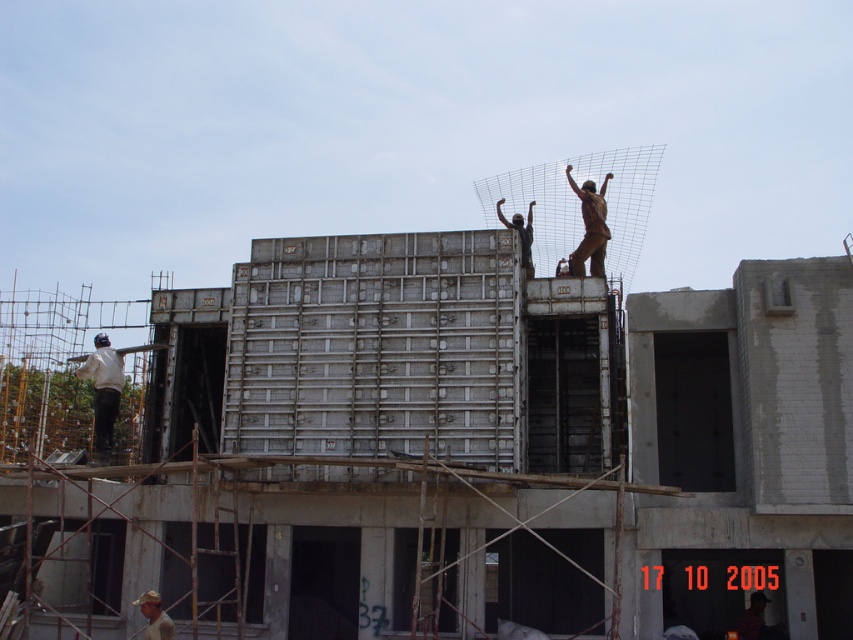
Question: Which point is farther from the camera taking this photo?

Choices:
 (A) (155, 605)
 (B) (531, 211)

Answer: (B)

Question: Does bronze statue at upper right appear on the left side of tan fabric cap at lower left?

Choices:
 (A) yes
 (B) no

Answer: (B)

Question: Is bronze statue at upper right smaller than matte black statue at upper center?

Choices:
 (A) yes
 (B) no

Answer: (B)

Question: Based on their relative distances, which object is farther from the tan fabric cap at lower left?

Choices:
 (A) bronze statue at upper right
 (B) matte black statue at upper center

Answer: (A)

Question: Is tan fabric cap at lower left positioned before matte black statue at upper center?

Choices:
 (A) no
 (B) yes

Answer: (B)

Question: Which object is the closest to the matte black statue at upper center?

Choices:
 (A) bronze statue at upper right
 (B) tan fabric cap at lower left

Answer: (A)